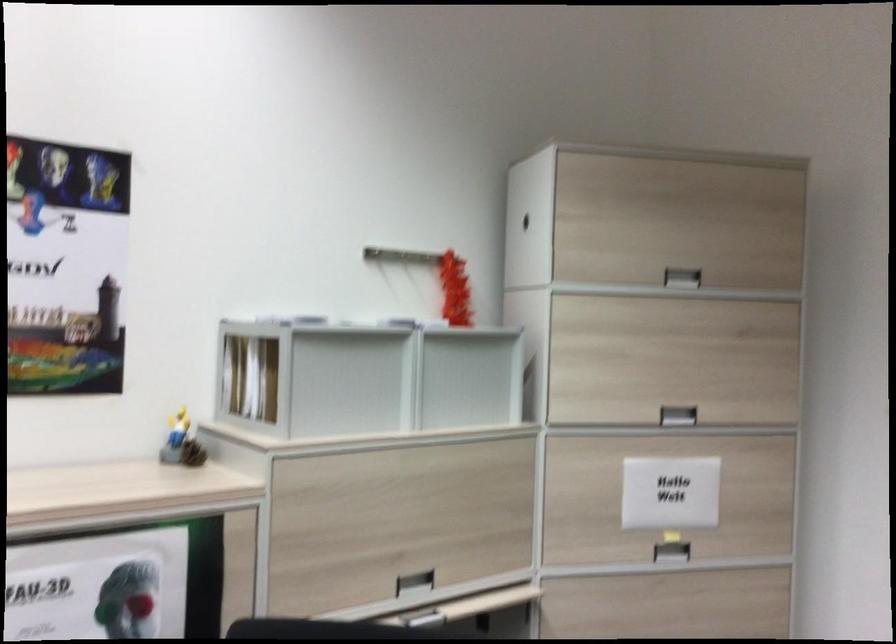
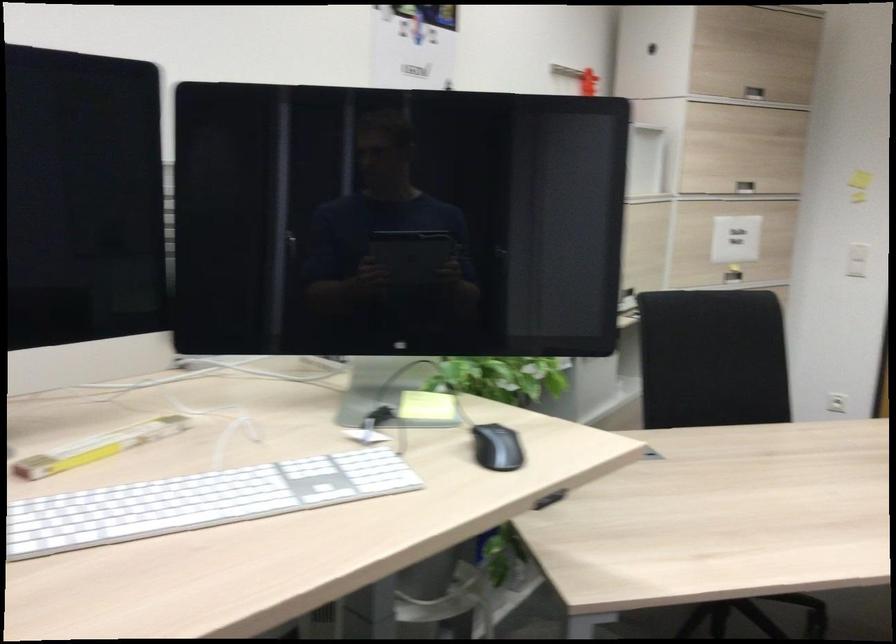
Question: I am providing you with two images of the same scene from different viewpoints. After the viewpoint changes to image2, which objects are now occluded?

Choices:
 (A) small yellow figurine
 (B) silver cabinet handle
 (C) black object
 (D) white computer keyboard

Answer: (A)